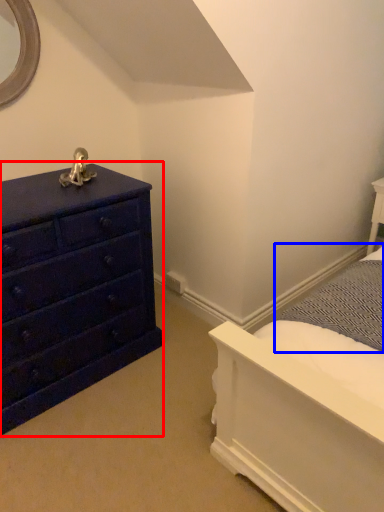
Question: Which point is closer to the camera, chest of drawers (highlighted by a red box) or bedding (highlighted by a blue box)?

Choices:
 (A) chest of drawers
 (B) bedding

Answer: (A)